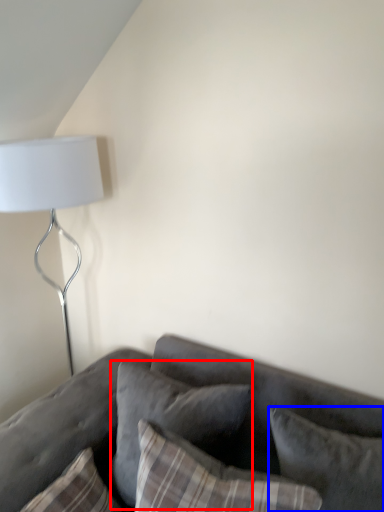
Question: Which of the following is the closest to the observer, pillow (highlighted by a red box) or pillow (highlighted by a blue box)?

Choices:
 (A) pillow
 (B) pillow

Answer: (B)